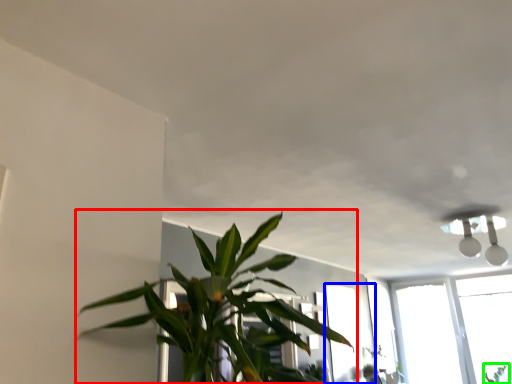
Question: Considering the real-world distances, which object is farthest from houseplant (highlighted by a red box)? window (highlighted by a blue box) or plant (highlighted by a green box)?

Choices:
 (A) window
 (B) plant

Answer: (B)